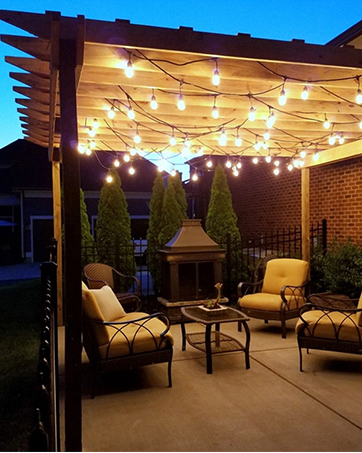
Find the location of `wall`. wall is located at coordinates (338, 216), (277, 203), (237, 192).